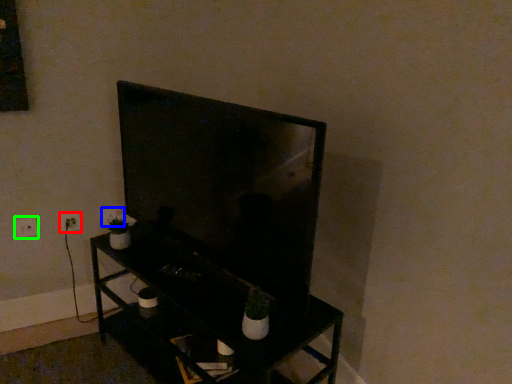
Question: Based on their relative distances, which object is farther from electric outlet (highlighted by a red box)? Choose from electric outlet (highlighted by a blue box) and electric outlet (highlighted by a green box).

Choices:
 (A) electric outlet
 (B) electric outlet

Answer: (A)